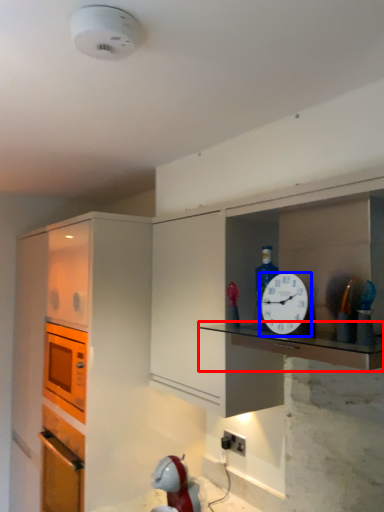
Question: Which object is further to the camera taking this photo, counter top (highlighted by a red box) or clock (highlighted by a blue box)?

Choices:
 (A) counter top
 (B) clock

Answer: (B)